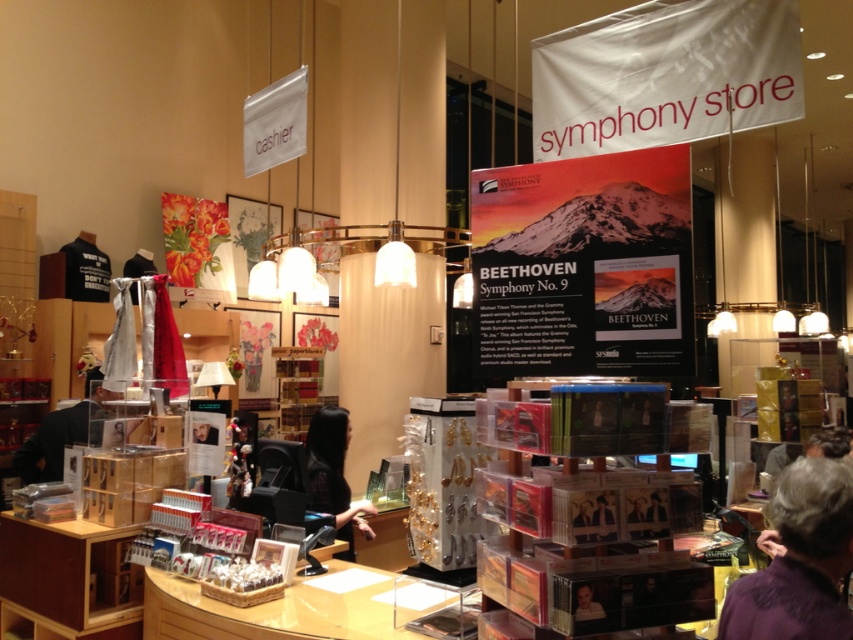
Who is higher up, black hair at cashier or dark gray fabric at left?

dark gray fabric at left is above.

Which is in front, point (323, 417) or point (48, 474)?

Positioned in front is point (48, 474).

Identify the location of black hair at cashier. This screenshot has height=640, width=853. (334, 474).

Who is more distant from viewer, (47, 451) or (589, 586)?

The point (47, 451) is behind.

What do you see at coordinates (61, 433) in the screenshot? This screenshot has width=853, height=640. I see `dark gray fabric at left` at bounding box center [61, 433].

Locate an element on the screen. The width and height of the screenshot is (853, 640). dark gray fabric at left is located at coordinates (61, 433).

Is black hair at cashier wider than smooth skin portrait at lower right?

Yes, black hair at cashier is wider than smooth skin portrait at lower right.

Can you confirm if black hair at cashier is positioned above smooth skin portrait at lower right?

Incorrect, black hair at cashier is not positioned above smooth skin portrait at lower right.

At what (x,y) coordinates should I click in order to perform the action: click on black hair at cashier. Please return your answer as a coordinate pair (x, y). Looking at the image, I should click on (334, 474).